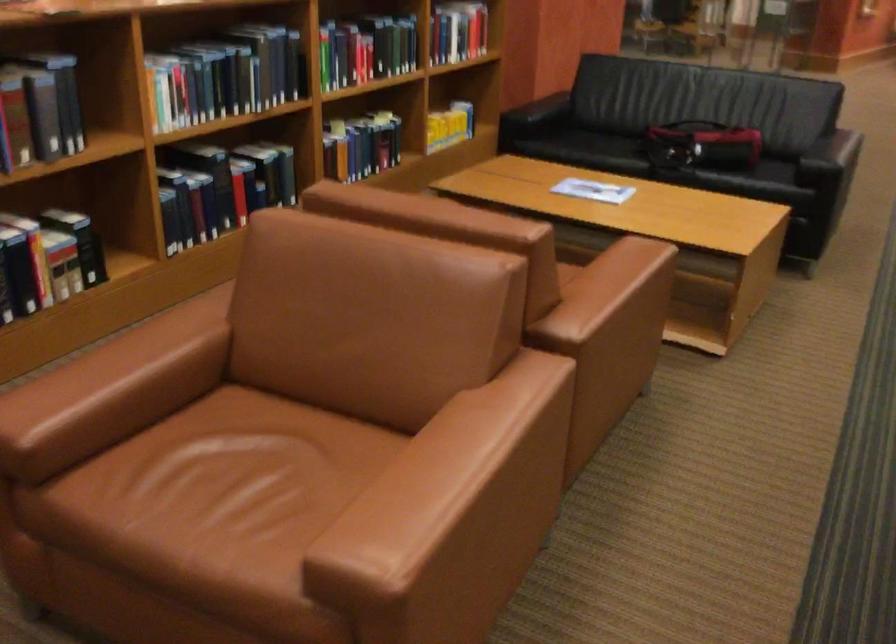
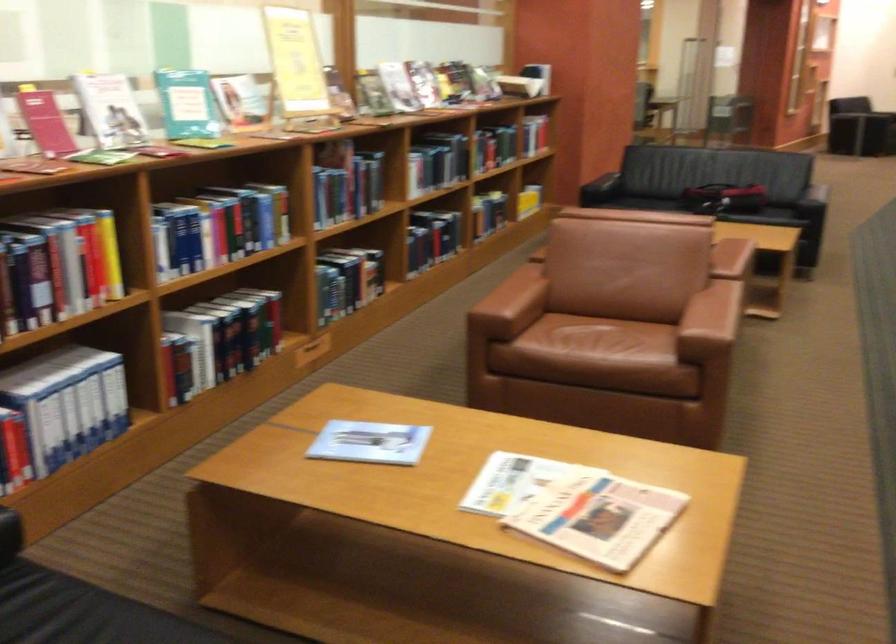
In the second image, find the point that corresponds to (495,413) in the first image.

(719, 296)